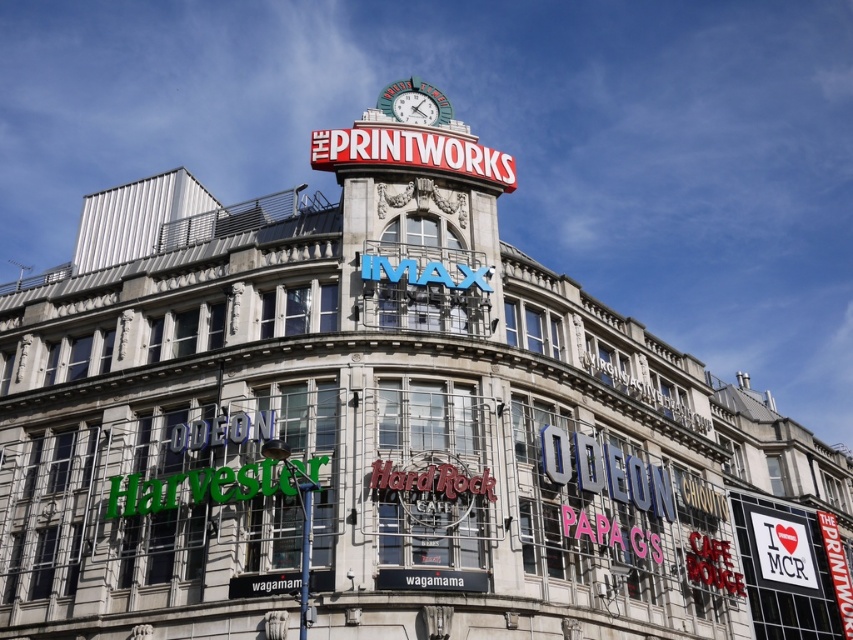
Is red metallic sign at center top thinner than white plastic sign at upper center?

No.

This screenshot has height=640, width=853. Find the location of `red metallic sign at center top`. red metallic sign at center top is located at coordinates (410, 152).

Where is `red metallic sign at center top`? The width and height of the screenshot is (853, 640). red metallic sign at center top is located at coordinates (410, 152).

In order to click on red metallic sign at center top in this screenshot , I will do `click(410, 152)`.

How much distance is there between red metallic sign at center top and metallic clock face at center top?

The distance of red metallic sign at center top from metallic clock face at center top is 9.71 feet.

From the picture: Who is higher up, red metallic sign at center top or metallic clock face at center top?

Positioned higher is metallic clock face at center top.

Which is behind, point (351, 138) or point (397, 109)?

The point (397, 109) is behind.

Identify the location of red metallic sign at center top. (410, 152).

Who is taller, white plastic sign at upper center or metallic clock face at center top?

With more height is white plastic sign at upper center.

Between white plastic sign at upper center and metallic clock face at center top, which one appears on the right side from the viewer's perspective?

Positioned to the right is white plastic sign at upper center.

You are a GUI agent. You are given a task and a screenshot of the screen. Output one action in this format:
    pyautogui.click(x=<x>, y=<y>)
    Task: Click on the white plastic sign at upper center
    
    Given the screenshot: What is the action you would take?
    pyautogui.click(x=782, y=550)